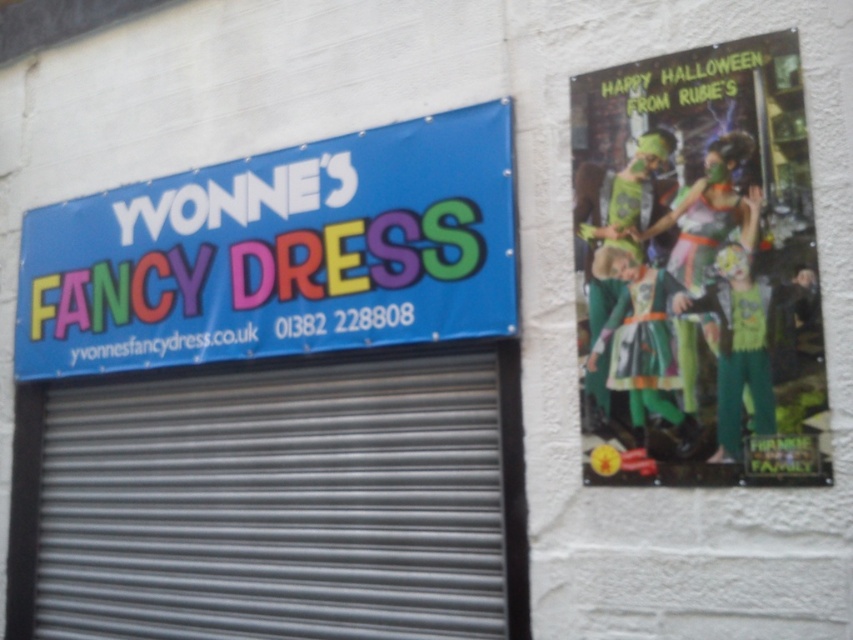
You are a delivery person trying to attach a package to the building. You have two options to place it either on the metallic gray garage door at center or on the blue fabric sign at upper left. Considering their sizes, which surface would be more stable for placing the package?

The metallic gray garage door at center is much taller than the blue fabric sign at upper left, so placing the package on the metallic gray garage door at center would be more stable due to its larger surface area.